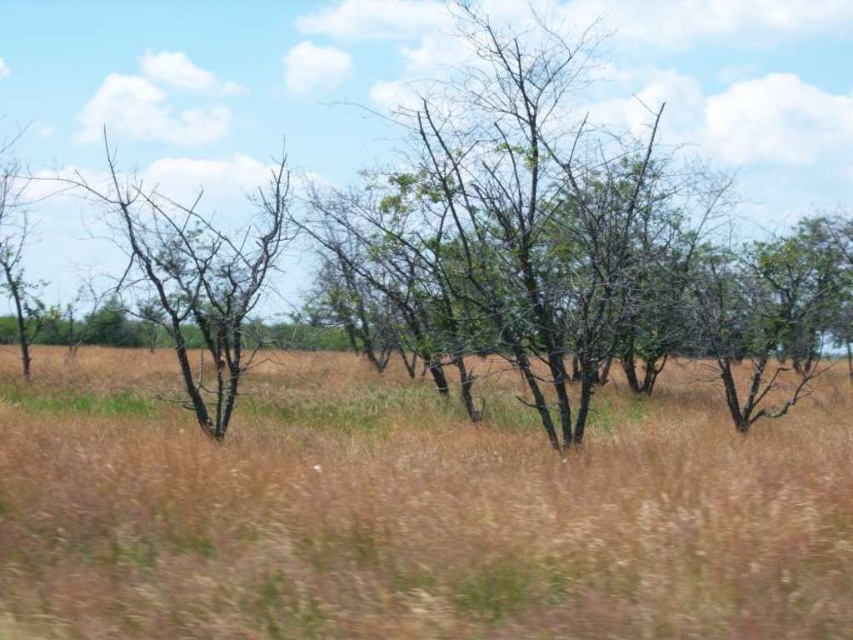
Question: Which object is closer to the camera taking this photo?

Choices:
 (A) brown bark tree at center
 (B) brown grass at center

Answer: (B)

Question: Is brown grass at center smaller than brown bark tree at center?

Choices:
 (A) no
 (B) yes

Answer: (B)

Question: Which point is farther from the camera taking this photo?

Choices:
 (A) (177, 189)
 (B) (86, 454)

Answer: (A)

Question: Can you confirm if brown grass at center is positioned above brown bark tree at center?

Choices:
 (A) yes
 (B) no

Answer: (B)

Question: Which object appears farthest from the camera in this image?

Choices:
 (A) brown grass at center
 (B) brown bark tree at center

Answer: (B)

Question: From the image, what is the correct spatial relationship of brown grass at center in relation to brown bark tree at center?

Choices:
 (A) right
 (B) left

Answer: (B)